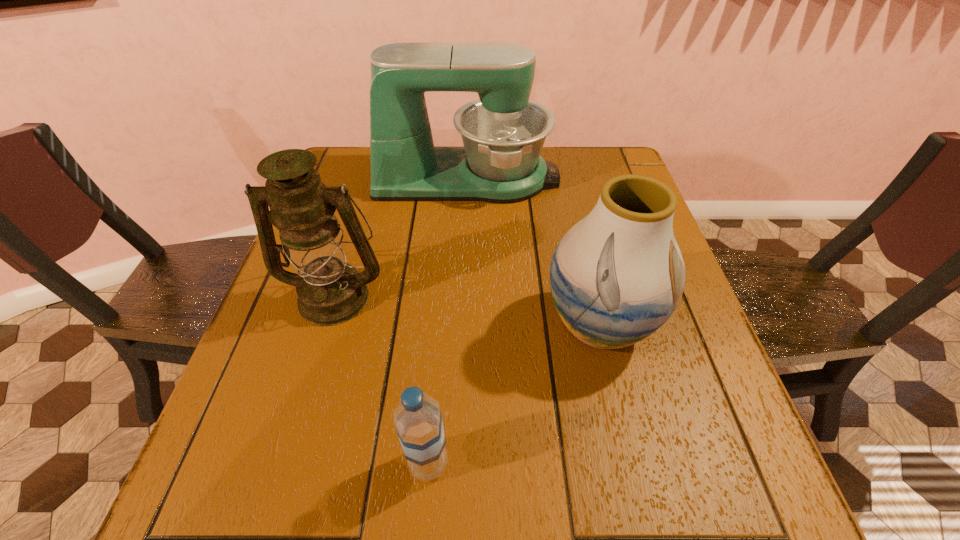
This screenshot has height=540, width=960. In order to click on object situated at the near edge in this screenshot , I will do `click(418, 421)`.

At what (x,y) coordinates should I click in order to perform the action: click on mixer positioned at the left edge. Please return your answer as a coordinate pair (x, y). The height and width of the screenshot is (540, 960). Looking at the image, I should click on (503, 133).

This screenshot has height=540, width=960. What are the coordinates of `oil lamp that is positioned at the left edge` in the screenshot? It's located at (330, 291).

Where is `object present at the right edge`? Image resolution: width=960 pixels, height=540 pixels. object present at the right edge is located at coordinates (616, 276).

Locate an element on the screen. object at the far left corner is located at coordinates (x=503, y=133).

In the image, there is a desktop. Where is `vacant space at the left edge`? The height and width of the screenshot is (540, 960). vacant space at the left edge is located at coordinates (293, 296).

Where is `vacant space at the right edge of the desktop`? The image size is (960, 540). vacant space at the right edge of the desktop is located at coordinates (694, 349).

The height and width of the screenshot is (540, 960). Find the location of `free region at the far right corner of the desktop`. free region at the far right corner of the desktop is located at coordinates (579, 158).

Locate an element on the screen. The height and width of the screenshot is (540, 960). free area in between the water bottle and the mixer is located at coordinates (447, 321).

This screenshot has height=540, width=960. I want to click on free space between the water bottle and the mixer, so click(x=447, y=321).